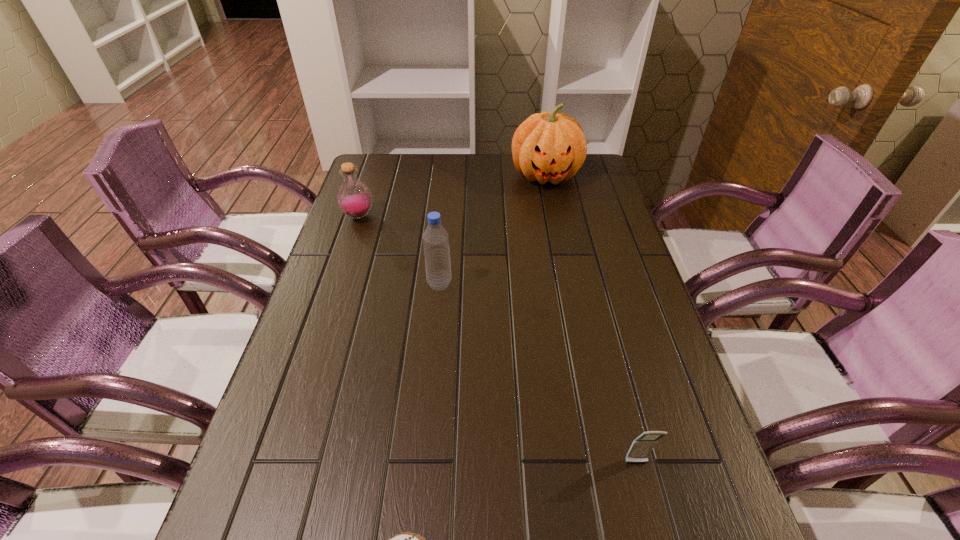
At what (x,y) coordinates should I click in order to perform the action: click on vacant area that lies between the third tallest object and the nearer bottle. Please return your answer as a coordinate pair (x, y). Looking at the image, I should click on (399, 250).

This screenshot has height=540, width=960. Identify the location of free space between the nearer bottle and the fourth nearest object. (399, 250).

Where is `free space between the fourth tallest object and the shorter bottle`? The height and width of the screenshot is (540, 960). free space between the fourth tallest object and the shorter bottle is located at coordinates (497, 340).

Where is `the third closest object to the fourth farthest object`? The image size is (960, 540). the third closest object to the fourth farthest object is located at coordinates (547, 146).

Identify which object is the third nearest to the pumpkin. Please provide its 2D coordinates. Your answer should be formatted as a tuple, i.e. [(x, y)], where the tuple contains the x and y coordinates of a point satisfying the conditions above.

[(641, 447)]